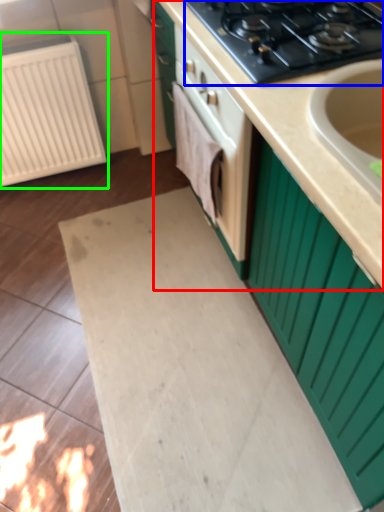
Question: Based on their relative distances, which object is nearer to countertop (highlighted by a red box)? Choose from gas stove (highlighted by a blue box) and radiator (highlighted by a green box).

Choices:
 (A) gas stove
 (B) radiator

Answer: (A)